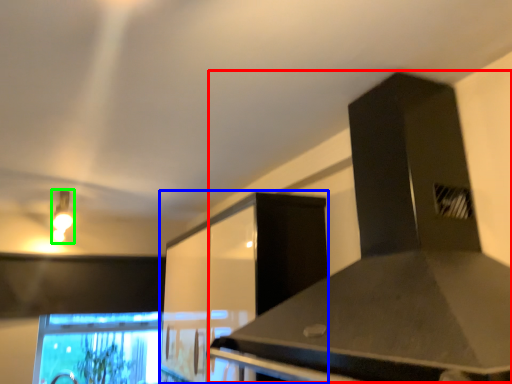
Question: Estimate the real-world distances between objects in this image. Which object is farther from vent (highlighted by a red box), cabinetry (highlighted by a blue box) or light fixture (highlighted by a green box)?

Choices:
 (A) cabinetry
 (B) light fixture

Answer: (B)